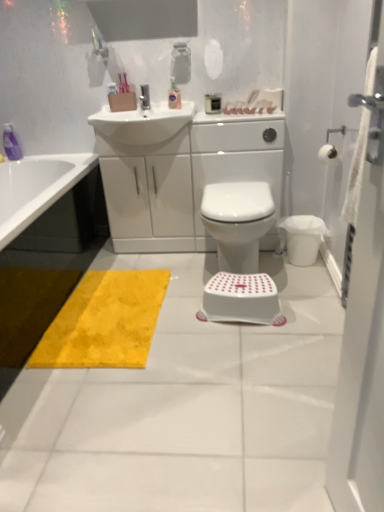
At what (x,y) coordinates should I click in order to perform the action: click on free space above white plastic bidet at center (from a real-world perspective). Please return your answer as a coordinate pair (x, y). Looking at the image, I should click on (240, 193).